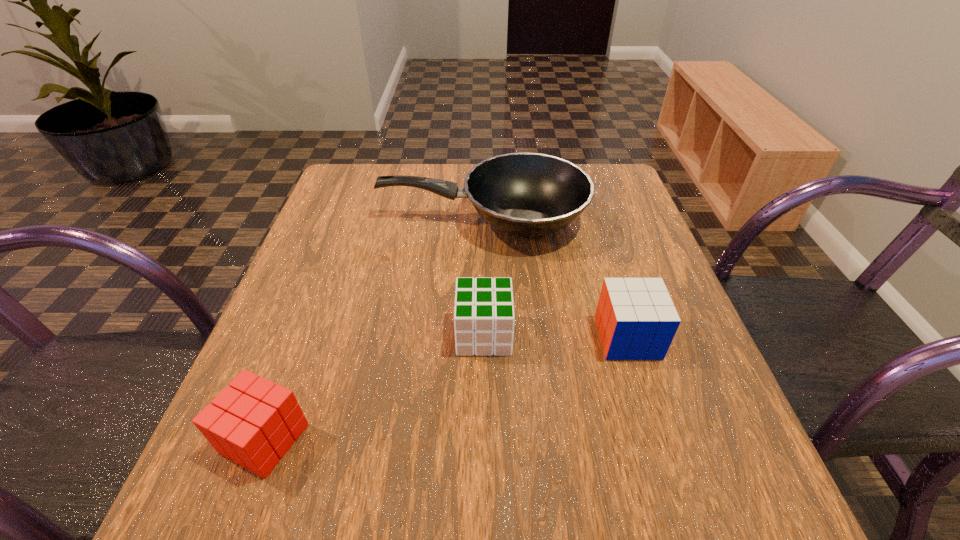
This screenshot has width=960, height=540. Find the location of `free spot located on the right of the leftmost object`. free spot located on the right of the leftmost object is located at coordinates (394, 438).

Find the location of a particular element. object that is at the far edge is located at coordinates coord(524,194).

Locate an element on the screen. Image resolution: width=960 pixels, height=540 pixels. object located in the near edge section of the desktop is located at coordinates (254, 422).

Where is `frying pan that is at the left edge`? The height and width of the screenshot is (540, 960). frying pan that is at the left edge is located at coordinates (524, 194).

Where is `cube that is at the left edge`? This screenshot has height=540, width=960. cube that is at the left edge is located at coordinates (254, 422).

Locate an element on the screen. This screenshot has height=540, width=960. frying pan that is at the right edge is located at coordinates (524, 194).

Where is `cube at the right edge`? This screenshot has height=540, width=960. cube at the right edge is located at coordinates (636, 319).

Image resolution: width=960 pixels, height=540 pixels. Find the location of `object located in the far left corner section of the desktop`. object located in the far left corner section of the desktop is located at coordinates (524, 194).

Where is `object that is positioned at the near left corner`? object that is positioned at the near left corner is located at coordinates (254, 422).

The width and height of the screenshot is (960, 540). Identify the location of object that is at the far right corner. (524, 194).